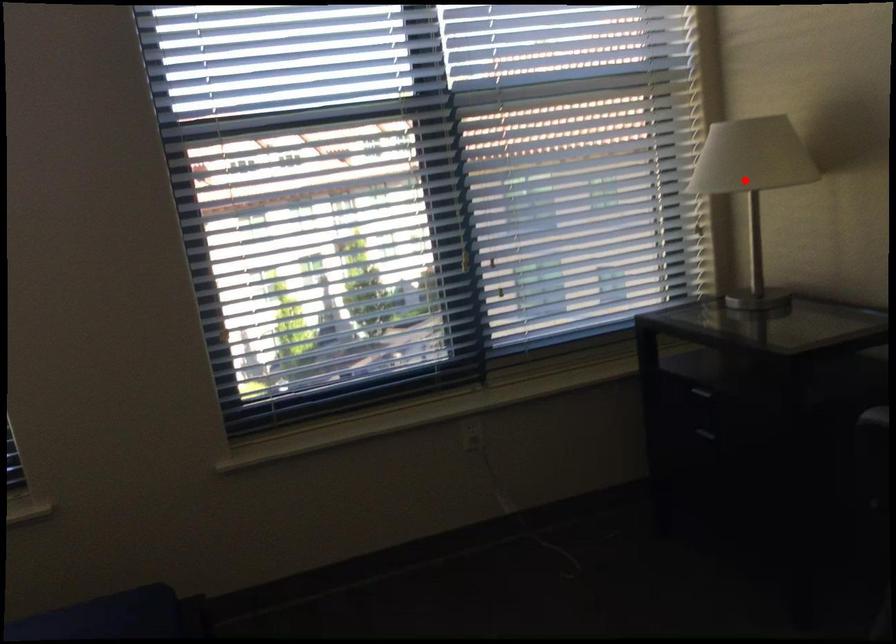
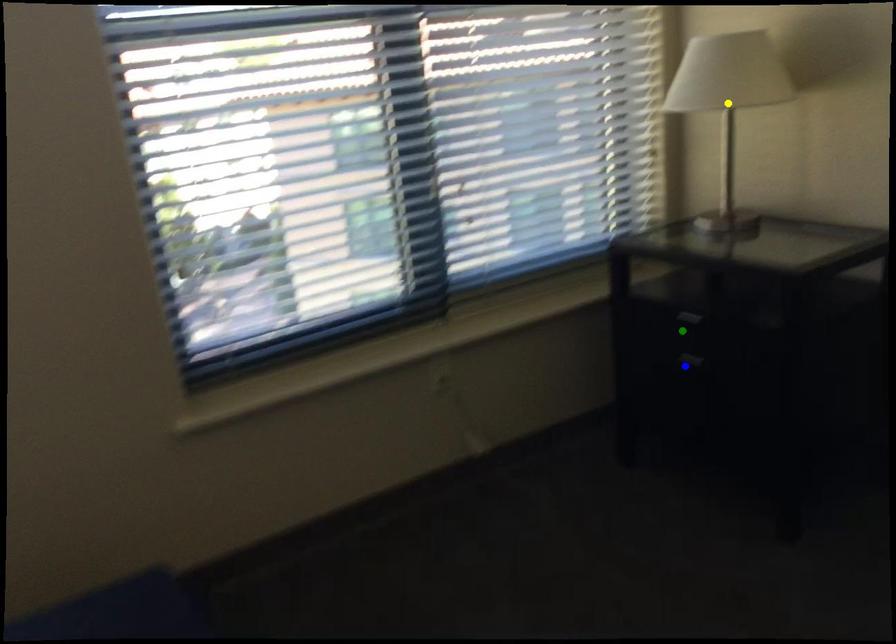
Question: I am providing you with two images of the same scene from different viewpoints. A red point is marked on the first image. You are given multiple points on the second image. Which point in image 2 is actually the same real-world point as the red point in image 1?

Choices:
 (A) blue point
 (B) green point
 (C) yellow point

Answer: (C)